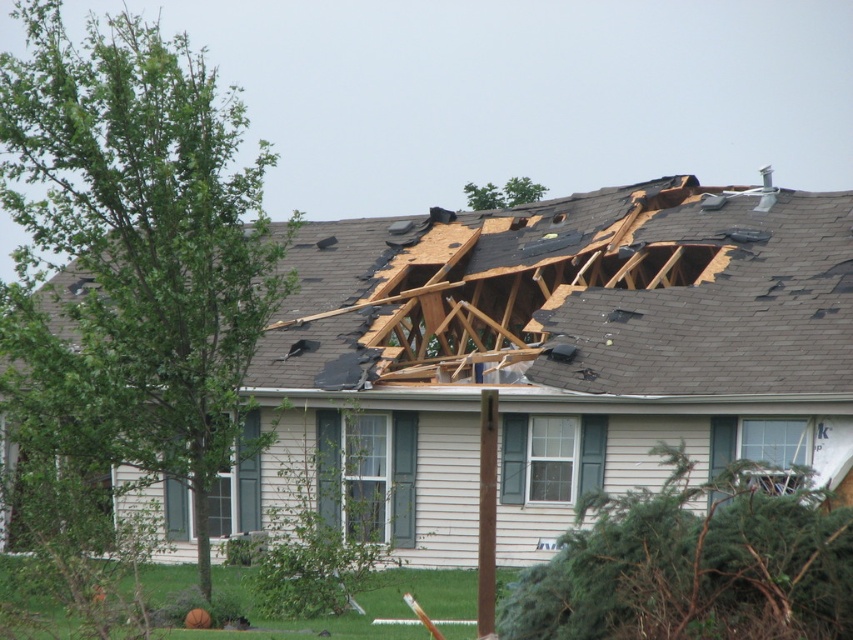
Does shiny gray shingles at upper center appear over brown wood pole at center?

Correct, shiny gray shingles at upper center is located above brown wood pole at center.

Does point (753, 310) lie behind point (480, 605)?

Yes, point (753, 310) is farther from viewer.

Locate an element on the screen. shiny gray shingles at upper center is located at coordinates (578, 296).